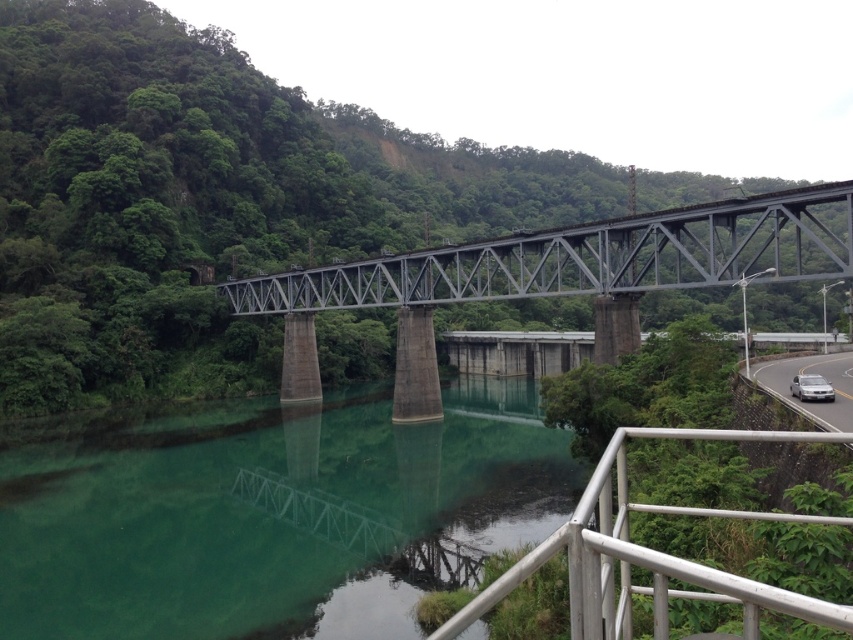
Can you confirm if metallic gray bridge at center is positioned above silver metallic railing at lower right?

Indeed, metallic gray bridge at center is positioned over silver metallic railing at lower right.

Can you confirm if metallic gray bridge at center is bigger than silver metallic railing at lower right?

Correct, metallic gray bridge at center is larger in size than silver metallic railing at lower right.

Find the location of `metallic gray bridge at center`. metallic gray bridge at center is located at coordinates (555, 276).

Which is more to the right, green concrete river at center or metallic gray bridge at center?

From the viewer's perspective, metallic gray bridge at center appears more on the right side.

Can you confirm if green concrete river at center is wider than metallic gray bridge at center?

Incorrect, green concrete river at center's width does not surpass metallic gray bridge at center's.

Locate an element on the screen. This screenshot has width=853, height=640. green concrete river at center is located at coordinates (273, 516).

Between green concrete river at center and white glossy car at right, which one is positioned higher?

white glossy car at right is higher up.

Between point (32, 528) and point (798, 403), which one is positioned behind?

Positioned behind is point (32, 528).

You are a GUI agent. You are given a task and a screenshot of the screen. Output one action in this format:
    pyautogui.click(x=<x>, y=<y>)
    Task: Click on the green concrete river at center
    
    Given the screenshot: What is the action you would take?
    pyautogui.click(x=273, y=516)